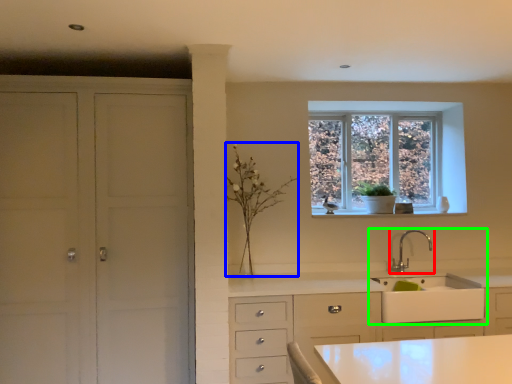
Question: Which is farther away from tap (highlighted by a red box)? plant (highlighted by a blue box) or sink (highlighted by a green box)?

Choices:
 (A) plant
 (B) sink

Answer: (A)